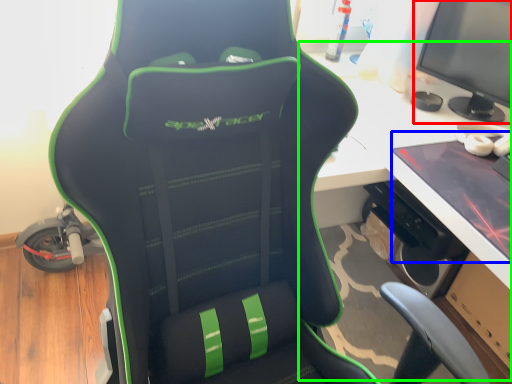
Question: Based on their relative distances, which object is nearer to computer monitor (highlighted by a red box)? Choose from laptop (highlighted by a blue box) and computer desk (highlighted by a green box).

Choices:
 (A) laptop
 (B) computer desk

Answer: (B)